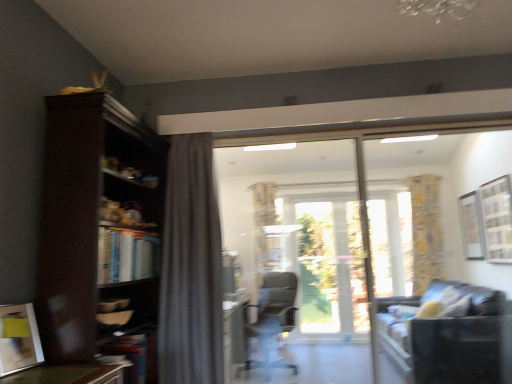
Question: Considering their positions, is matte yellow picture frame at lower left, which is counted as the second picture frame, starting from the right, located in front of or behind white matte picture frame at upper right, arranged as the first picture frame when viewed from the right?

Choices:
 (A) behind
 (B) front

Answer: (B)

Question: Is matte yellow picture frame at lower left, the second picture frame from the back, to the left or to the right of white matte picture frame at upper right, placed as the first picture frame when sorted from back to front, in the image?

Choices:
 (A) right
 (B) left

Answer: (B)

Question: Based on their relative distances, which object is nearer to the white matte picture frame at upper right, the 2th picture frame viewed from the front?

Choices:
 (A) transparent glass screen door at center
 (B) matte yellow picture frame at lower left, the second picture frame from the back
 (C) transparent glass door at center
 (D) matte gray office chair at center
 (E) dark gray fabric couch at lower right

Answer: (C)

Question: Based on their relative distances, which object is nearer to the dark wood bookcase at left?

Choices:
 (A) dark gray fabric couch at lower right
 (B) hardcover books at left
 (C) transparent glass screen door at center
 (D) white matte picture frame at upper right, the 2th picture frame viewed from the front
 (E) matte gray office chair at center

Answer: (B)